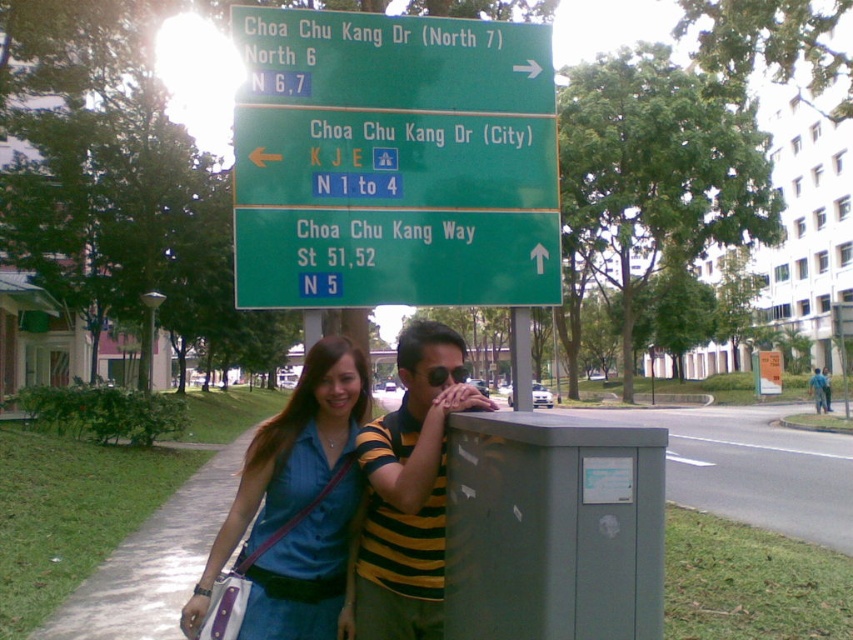
Question: Among these objects, which one is farthest from the camera?

Choices:
 (A) yellow striped shirt at center
 (B) green matte sign at upper center
 (C) striped shirt at center

Answer: (C)

Question: Does denim shirt at center appear on the right side of yellow striped shirt at center?

Choices:
 (A) yes
 (B) no

Answer: (B)

Question: Can you confirm if green matte sign at center is bigger than yellow striped shirt at center?

Choices:
 (A) no
 (B) yes

Answer: (A)

Question: Does denim shirt at center have a lesser width compared to green plastic sign at upper center?

Choices:
 (A) no
 (B) yes

Answer: (A)

Question: Which point is farther from the camera taking this photo?

Choices:
 (A) (399, 250)
 (B) (289, 161)

Answer: (A)

Question: Which point is closer to the camera?

Choices:
 (A) (378, 214)
 (B) (480, 45)
 (C) (289, 486)

Answer: (C)